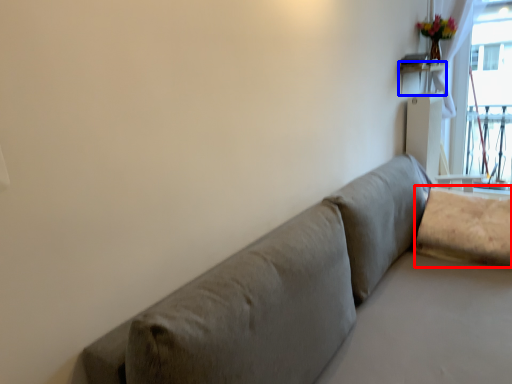
Question: Among these objects, which one is farthest to the camera, pillow (highlighted by a red box) or table (highlighted by a blue box)?

Choices:
 (A) pillow
 (B) table

Answer: (B)